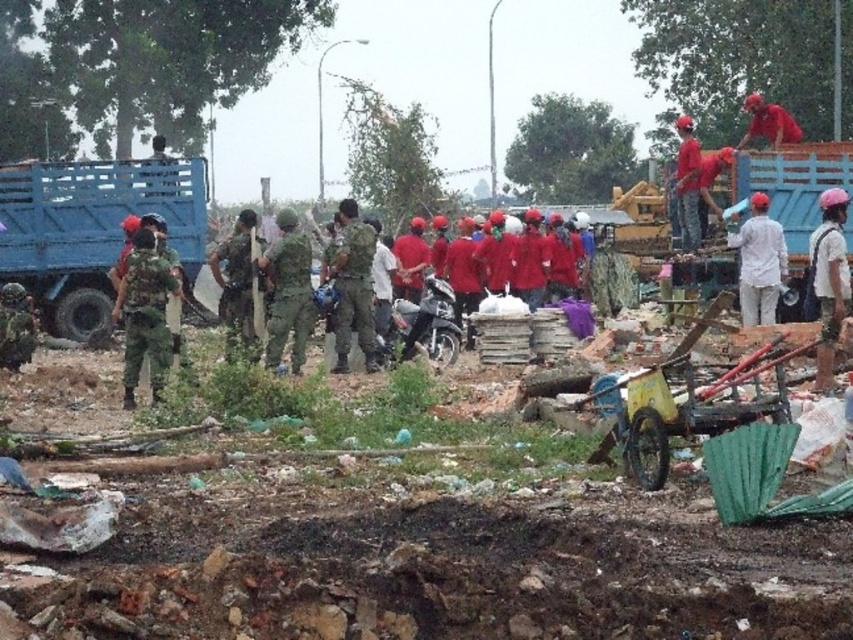
Question: In this image, where is camouflage fabric uniform at left located relative to red matte helmet at upper right?

Choices:
 (A) left
 (B) right

Answer: (A)

Question: Is camouflage fabric uniform at left wider than metallic silver motorcycle at center?

Choices:
 (A) no
 (B) yes

Answer: (A)

Question: Is camouflage fabric construction worker at center closer to camera compared to red matte helmet at upper right?

Choices:
 (A) yes
 (B) no

Answer: (A)

Question: Among these points, which one is farthest from the camera?

Choices:
 (A) (303, 323)
 (B) (438, 324)
 (C) (115, 308)

Answer: (B)

Question: Which object is positioned farthest from the pink fabric cap at upper right?

Choices:
 (A) white matte shirt at upper right
 (B) metallic silver motorcycle at center
 (C) camouflage fabric uniform at center

Answer: (C)

Question: Estimate the real-world distances between objects in this image. Which object is farther from the red matte uniform at center?

Choices:
 (A) camouflage fabric uniform at left
 (B) camouflage fabric construction worker at center
 (C) red matte helmet at upper right

Answer: (C)